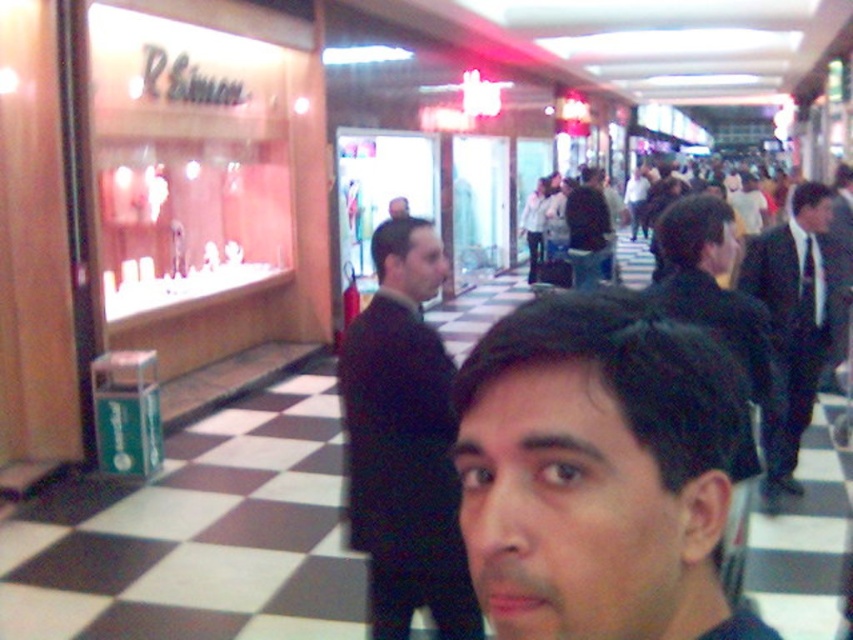
In the scene shown: Is black suit at center bigger than dark brown suit at center?

Yes.

Between black suit at center and dark brown suit at center, which one appears on the right side from the viewer's perspective?

dark brown suit at center

Does point (398, 230) come behind point (596, 243)?

No, (398, 230) is in front of (596, 243).

Where is `black suit at center`? black suit at center is located at coordinates (404, 444).

Is dark hair at center positioned before black suit at right?

Yes.

Is dark hair at center shorter than black suit at right?

Indeed, dark hair at center has a lesser height compared to black suit at right.

Measure the distance between dark hair at center and camera.

The distance of dark hair at center from camera is 56.98 centimeters.

I want to click on dark hair at center, so click(x=598, y=472).

Does dark hair at center appear over black suit at center?

Yes.

This screenshot has height=640, width=853. What do you see at coordinates (598, 472) in the screenshot? I see `dark hair at center` at bounding box center [598, 472].

Does point (648, 490) lie behind point (370, 504)?

No, it is in front of (370, 504).

At what (x,y) coordinates should I click in order to perform the action: click on dark hair at center. Please return your answer as a coordinate pair (x, y). The image size is (853, 640). Looking at the image, I should click on (598, 472).